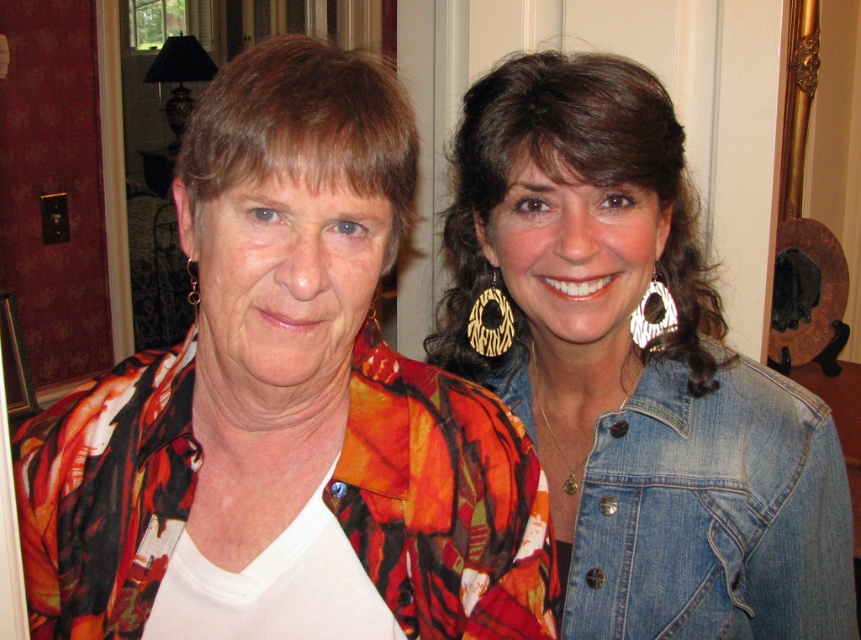
You are organizing a clothing rack in a store and see the denim jacket at upper right and the faded denim jacket at lower right. Which one should you place higher on the rack to match their current positions?

You should place the denim jacket at upper right higher on the rack since it is already positioned above the faded denim jacket at lower right in their current arrangement.

You are trying to decide which jacket to wear for a casual outing. Both the denim jacket at upper right and the faded denim jacket at lower right are options. Based on their positions in the image, which one might be more spacious in size?

Answer: The denim jacket at upper right might be wider than faded denim jacket at lower right, so it could be more spacious in size.